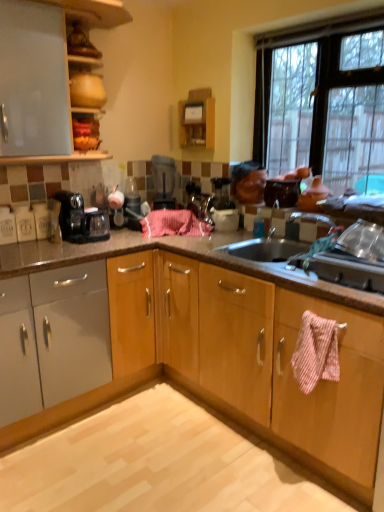
Where is `free space above light brown polished granite at lower center (from a real-world perspective)`? The height and width of the screenshot is (512, 384). free space above light brown polished granite at lower center (from a real-world perspective) is located at coordinates (136, 458).